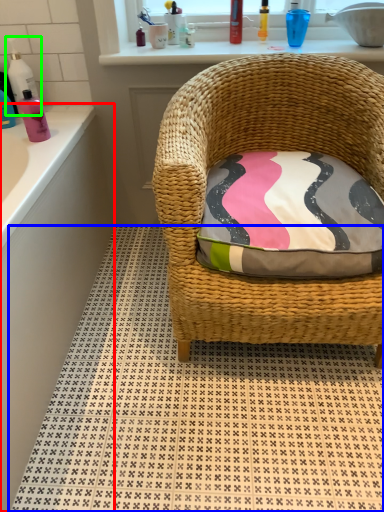
Question: Based on their relative distances, which object is farther from bath (highlighted by a red box)? Choose from pattern (highlighted by a blue box) and cleaning product (highlighted by a green box).

Choices:
 (A) pattern
 (B) cleaning product

Answer: (B)